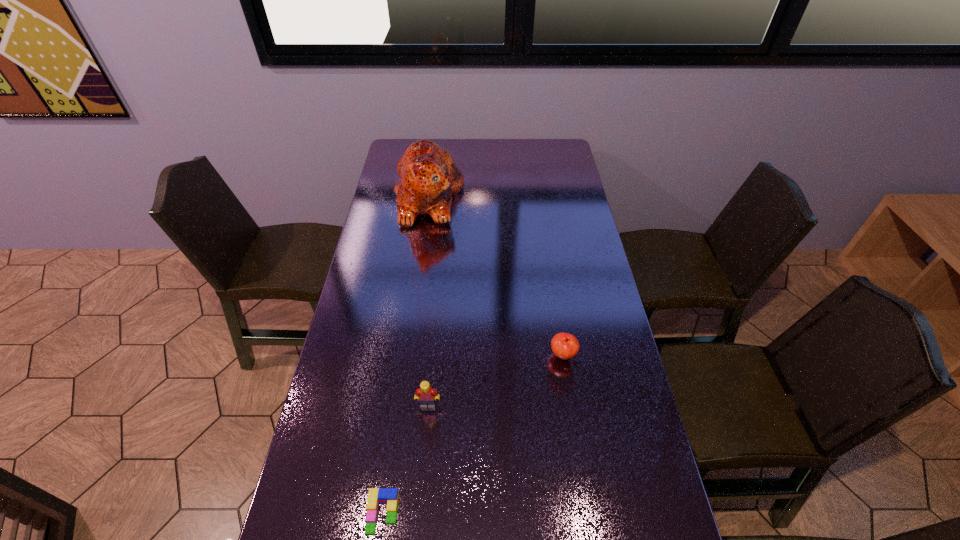
I want to click on cat, so click(429, 179).

Find the location of a particular element. the farthest object is located at coordinates (429, 179).

At what (x,y) coordinates should I click in order to perform the action: click on the third farthest object. Please return your answer as a coordinate pair (x, y). This screenshot has height=540, width=960. Looking at the image, I should click on (425, 394).

Where is `the right Lego`? the right Lego is located at coordinates (425, 394).

You are a GUI agent. You are given a task and a screenshot of the screen. Output one action in this format:
    pyautogui.click(x=<x>, y=<y>)
    Task: Click on the apple
    This screenshot has width=960, height=540.
    Given the screenshot: What is the action you would take?
    pyautogui.click(x=565, y=346)

Locate an element on the screen. The width and height of the screenshot is (960, 540). the second farthest object is located at coordinates (565, 346).

Where is `the nearest object`? the nearest object is located at coordinates (376, 496).

Where is `the shorter Lego`? the shorter Lego is located at coordinates (376, 496).

Identify the location of vacant space located 0.260m on the face of the cat. (527, 197).

I want to click on free space located on the front-facing side of the third farthest object, so click(425, 435).